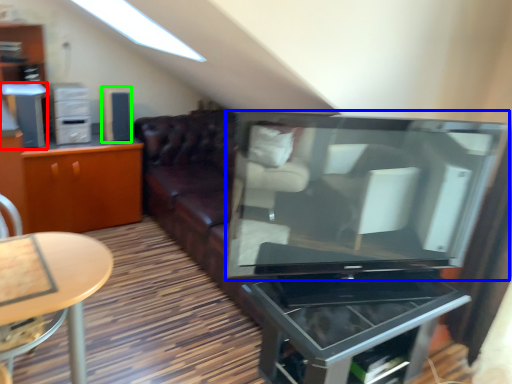
Question: Estimate the real-world distances between objects in this image. Which object is farther from appliance (highlighted by a red box), television (highlighted by a blue box) or appliance (highlighted by a green box)?

Choices:
 (A) television
 (B) appliance

Answer: (A)